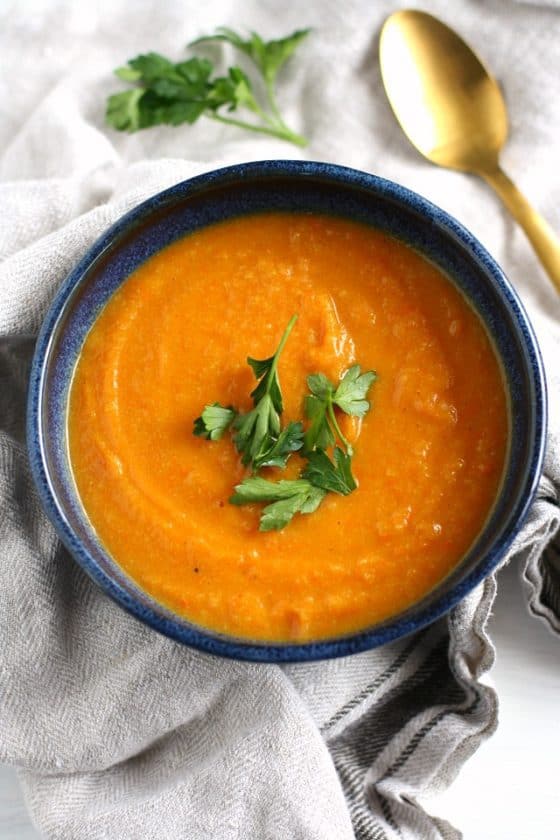
The width and height of the screenshot is (560, 840). Find the location of `white tablecloth`. white tablecloth is located at coordinates (515, 738), (60, 48), (10, 811).